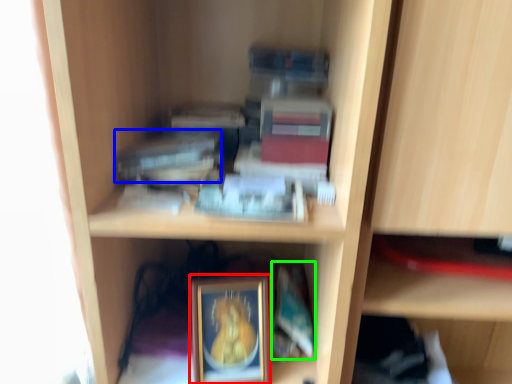
Question: Which object is the closest to the picture frame (highlighted by a red box)? Choose among these: paperback book (highlighted by a blue box) or paperback book (highlighted by a green box).

Choices:
 (A) paperback book
 (B) paperback book

Answer: (B)